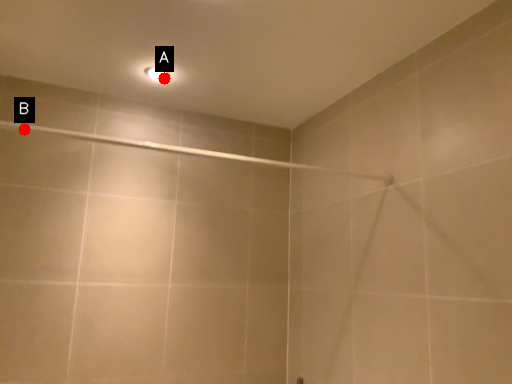
Question: Two points are circled on the image, labeled by A and B beside each circle. Which point is closer to the camera?

Choices:
 (A) A is closer
 (B) B is closer

Answer: (A)